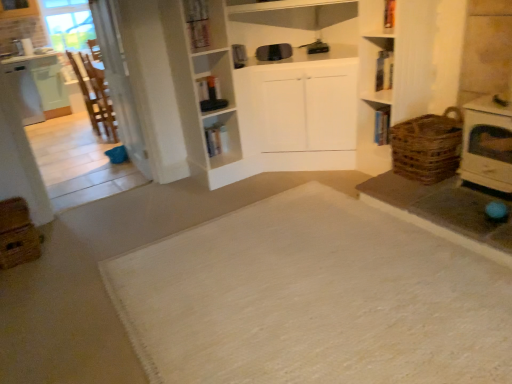
Question: Considering their positions, is white woven mat at center located in front of or behind brown woven basket at right?

Choices:
 (A) behind
 (B) front

Answer: (B)

Question: Does point 336,236 appear closer or farther from the camera than point 435,165?

Choices:
 (A) farther
 (B) closer

Answer: (B)

Question: Which is farther from the white woven mat at center?

Choices:
 (A) brown woven basket at right
 (B) brown woven crate at lower left
 (C) wooden chair at left

Answer: (C)

Question: Which object is the farthest from the brown woven crate at lower left?

Choices:
 (A) white woven mat at center
 (B) brown woven basket at right
 (C) wooden chair at left

Answer: (B)